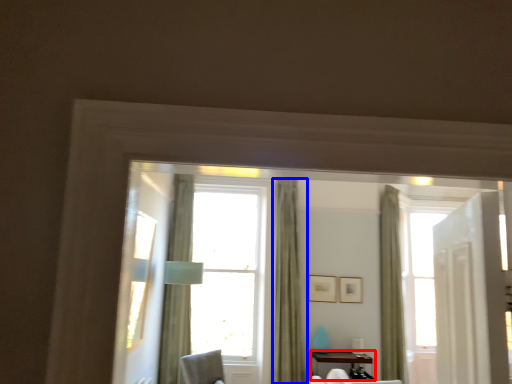
Question: Which of the following is the closest to the observer, table (highlighted by a red box) or curtain (highlighted by a blue box)?

Choices:
 (A) table
 (B) curtain

Answer: (A)